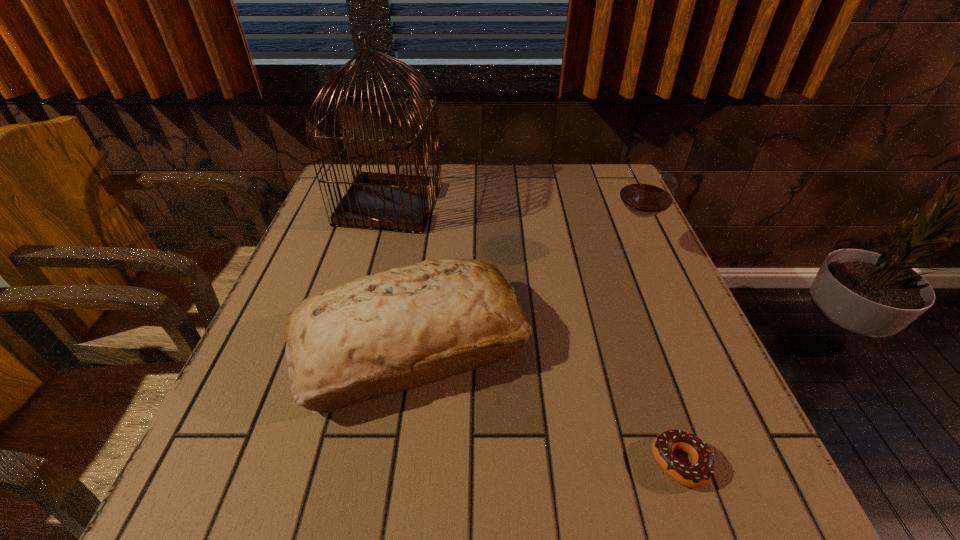
Image resolution: width=960 pixels, height=540 pixels. Find the location of `the farthest object`. the farthest object is located at coordinates (397, 202).

Identify the location of the tallest object. (397, 202).

Where is `the third shortest object`? Image resolution: width=960 pixels, height=540 pixels. the third shortest object is located at coordinates (647, 192).

This screenshot has height=540, width=960. What are the coordinates of `the second farthest object` in the screenshot? It's located at (647, 192).

Locate an element on the screen. This screenshot has height=540, width=960. bread is located at coordinates (377, 335).

Locate an element on the screen. The image size is (960, 540). the third farthest object is located at coordinates (377, 335).

What are the coordinates of `the nearest object` in the screenshot? It's located at (696, 475).

The image size is (960, 540). In order to click on the shortest object in this screenshot , I will do `click(696, 475)`.

At what (x,y) coordinates should I click in order to perform the action: click on free location located on the front of the birdcage. Please return your answer as a coordinate pair (x, y). Looking at the image, I should click on (352, 339).

Where is `vacant space situated on the left of the third shortest object`? The width and height of the screenshot is (960, 540). vacant space situated on the left of the third shortest object is located at coordinates (525, 253).